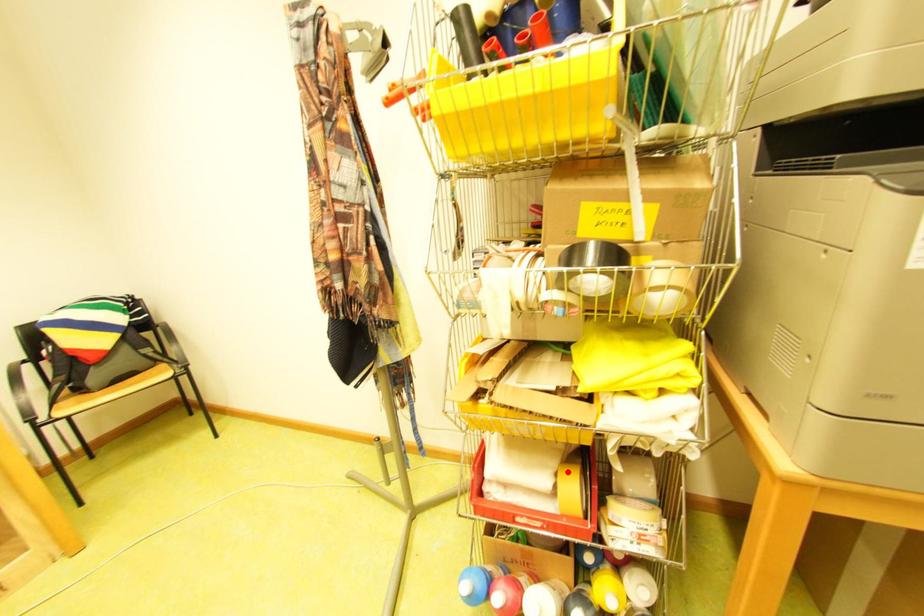
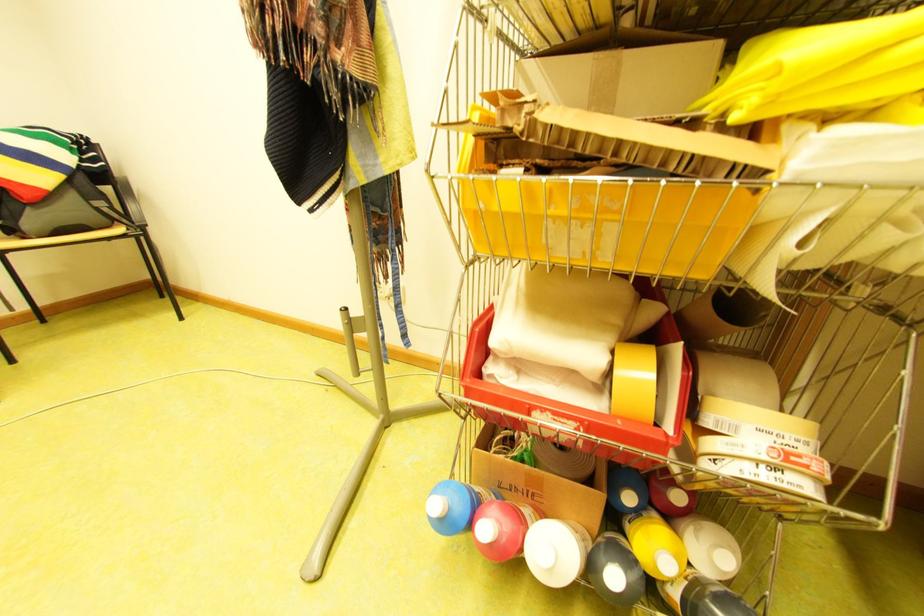
Where in the second image is the point corresponding to the highlighted location from the first image?

(622, 347)